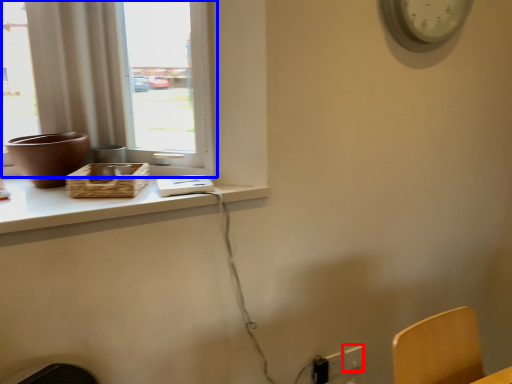
Question: Among these objects, which one is nearest to the camera, electric outlet (highlighted by a red box) or window (highlighted by a blue box)?

Choices:
 (A) electric outlet
 (B) window

Answer: (B)